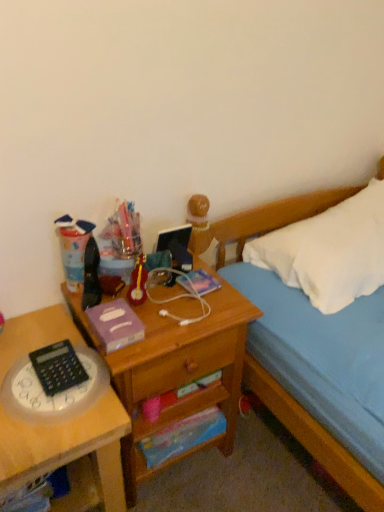
Identify the location of vacant area that is in front of metallic purple paperback book at center, the 2th paperback book viewed from the front. The height and width of the screenshot is (512, 384). (193, 315).